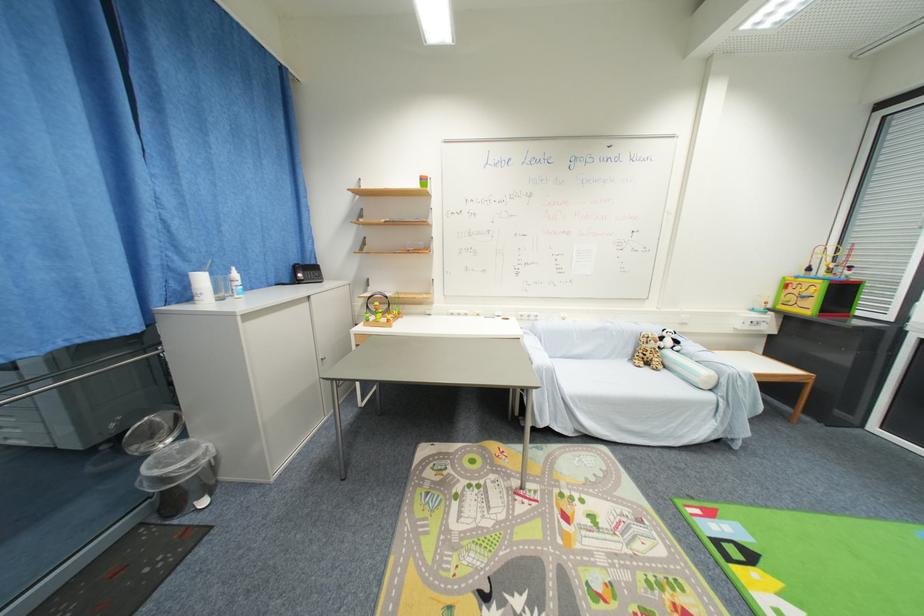
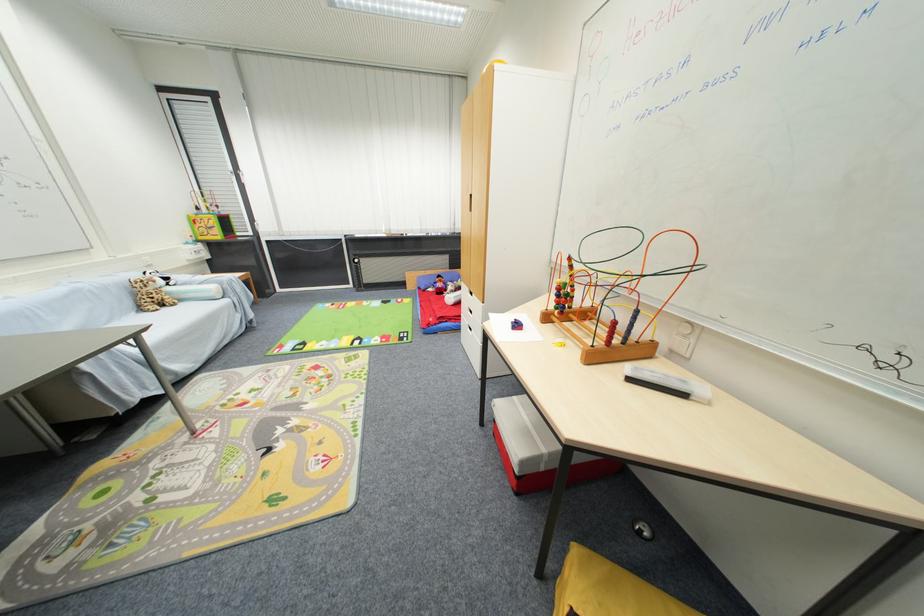
In the second image, find the point that corresponds to (710,375) in the first image.

(217, 290)